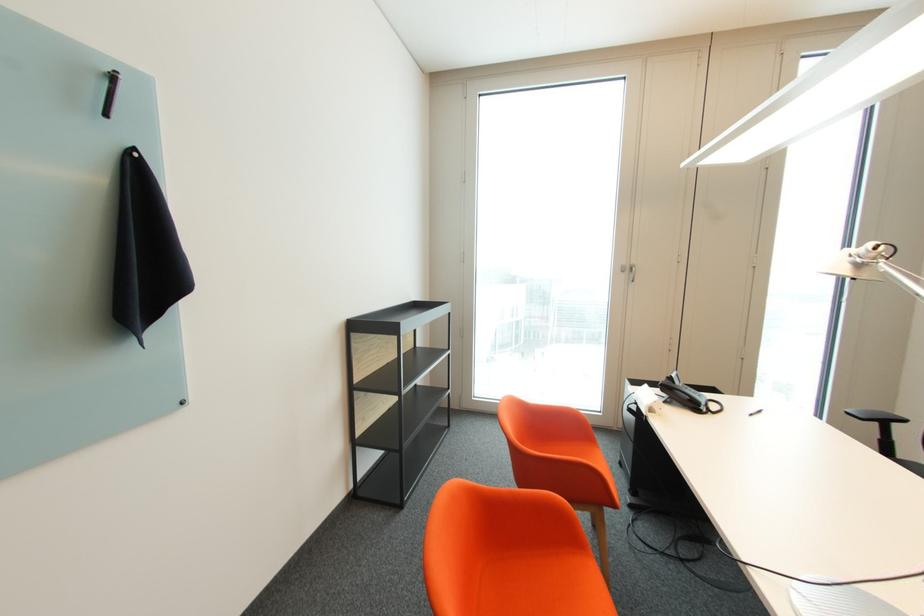
You are a GUI agent. You are given a task and a screenshot of the screen. Output one action in this format:
    pyautogui.click(x=<x>, y=<y>)
    Task: Click on the orange chair sitting surface
    The width and height of the screenshot is (924, 616).
    Given the screenshot: What is the action you would take?
    pyautogui.click(x=532, y=584)